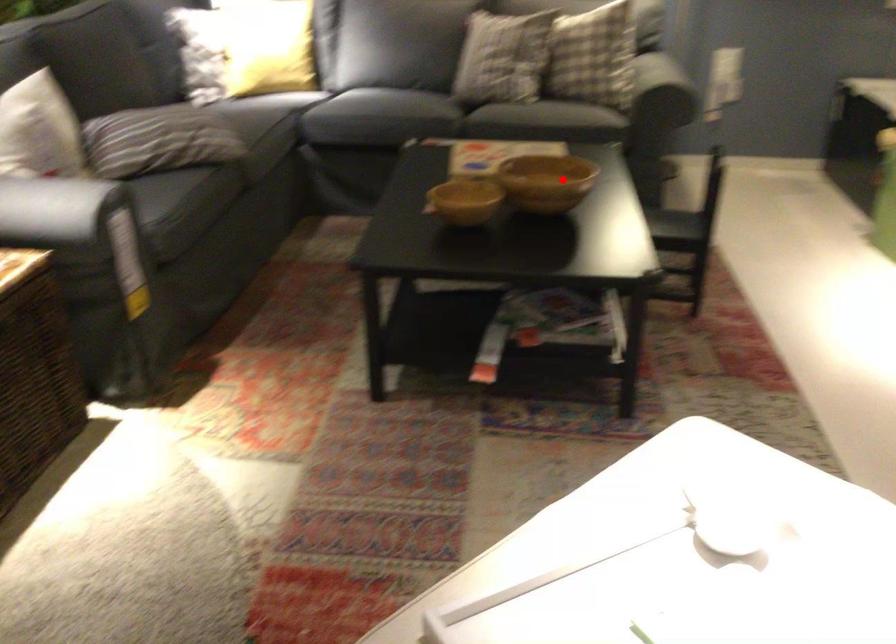
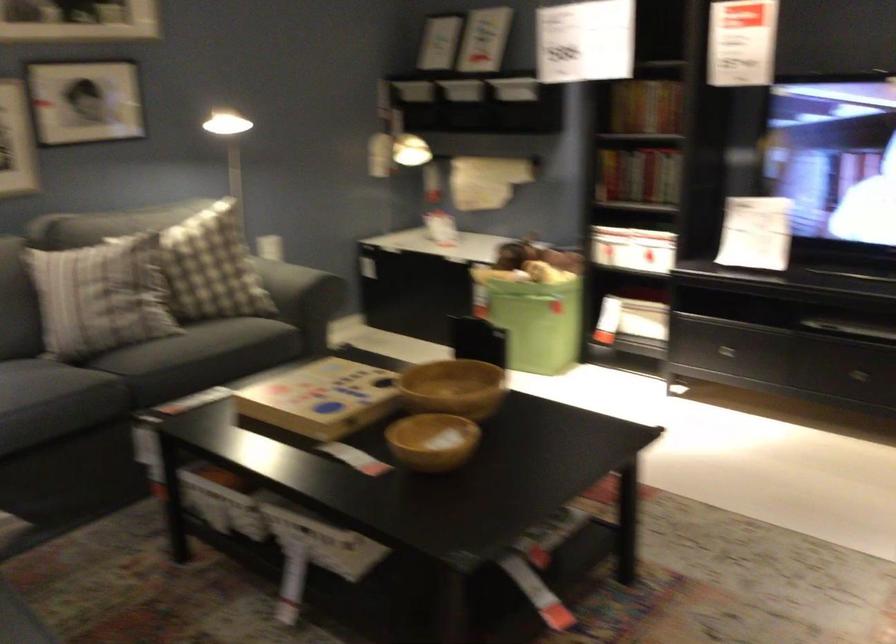
Where in the second image is the point corresponding to the highlighted location from the first image?

(453, 388)